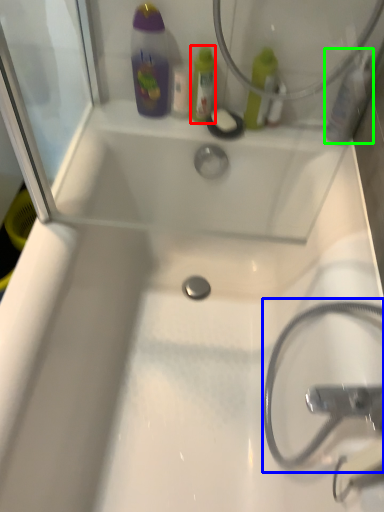
Question: Based on their relative distances, which object is nearer to mouthwash (highlighted by a red box)? Choose from garden hose (highlighted by a blue box) and mouthwash (highlighted by a green box).

Choices:
 (A) garden hose
 (B) mouthwash

Answer: (B)